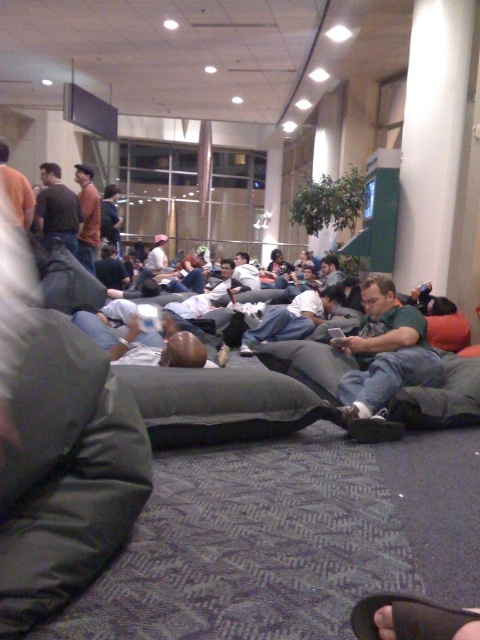
You are a security camera positioned at the ceiling of the indoor space. Your task is to locate the denim jeans at center. What are their coordinates?

The coordinates of the denim jeans at center are at point (291, 317).

You are a photographer trying to capture a candid shot of two people sitting at the center of the room. The subjects are wearing denim jeans at center and orange sweater at center. Since you want to ensure both are clearly visible in the frame, which subject should you focus on first to account for their size difference?

The denim jeans at center is larger in size than the orange sweater at center, so you should focus on the denim jeans at center first to ensure it is clearly visible before adjusting the frame for the smaller orange sweater at center.